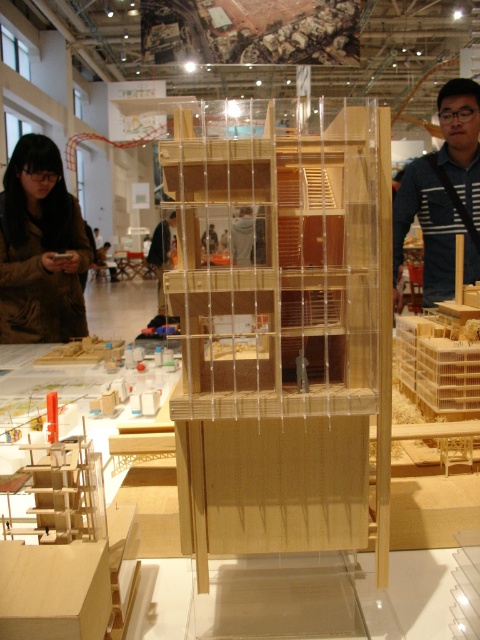
You are an architect visiting an exhibition and notice the brown leather jacket at lower left and the wooden figure at center. If you want to place a new model between them, how far apart should you position them from each other?

The brown leather jacket at lower left and wooden figure at center are 17.69 feet apart, so you should position the new model between them at a distance of 8.845 feet from each.

You are an architect examining the architectural model display. You notice the wooden cage at center and the blue striped shirt at upper right. Which object is positioned closer to your viewpoint?

The wooden cage at center is closer to the viewer than the blue striped shirt at upper right.

You are a curator examining the architectural models in the exhibition space. You notice two points marked on the main model at coordinates point [210,401] and point [437,193]. Which point is closer to you when you are facing the model directly?

Point [210,401] is in front of point [437,193], so it is closer to you when facing the model directly.